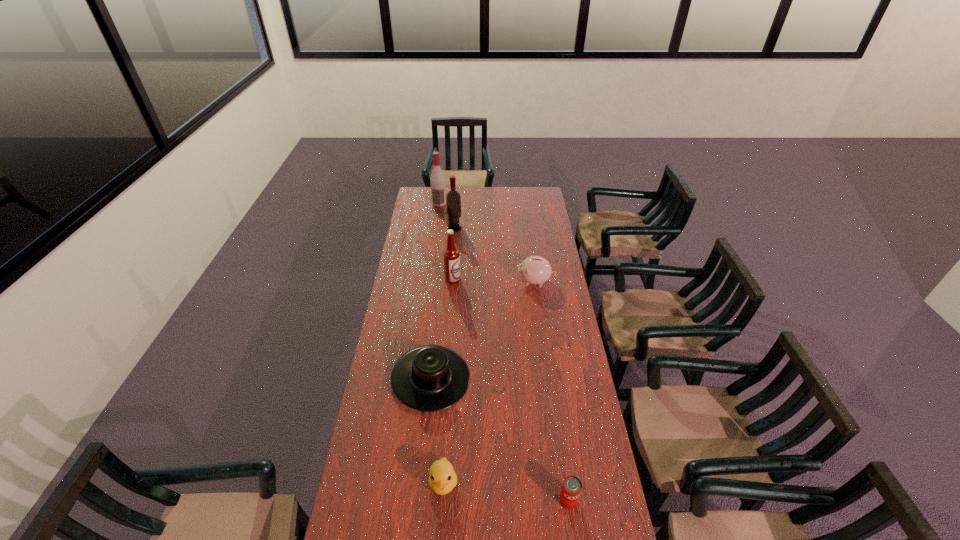
The width and height of the screenshot is (960, 540). In order to click on unoccupied area between the fifth farthest object and the sixth nearest object in this screenshot , I will do `click(443, 303)`.

Identify which object is the second nearest to the leftmost alcohol. Please provide its 2D coordinates. Your answer should be formatted as a tuple, i.e. [(x, y)], where the tuple contains the x and y coordinates of a point satisfying the conditions above.

[(451, 254)]

Locate which object ranks sixth in proximity to the fifth farthest object. Please provide its 2D coordinates. Your answer should be formatted as a tuple, i.e. [(x, y)], where the tuple contains the x and y coordinates of a point satisfying the conditions above.

[(437, 180)]

Image resolution: width=960 pixels, height=540 pixels. What are the coordinates of `alcohol that stands as the third closest to the can` in the screenshot? It's located at (437, 180).

Locate an element on the screen. Image resolution: width=960 pixels, height=540 pixels. alcohol that is the closest one to the second farthest alcohol is located at coordinates [x=437, y=180].

Locate an element on the screen. vacant space that satisfies the following two spatial constraints: 1. on the label of the dress hat; 2. on the left side of the leftmost alcohol is located at coordinates (417, 378).